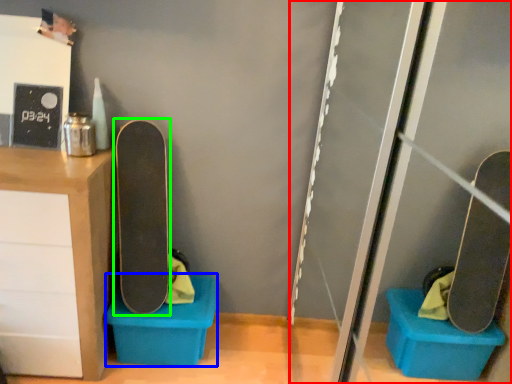
Question: Which is farther away from screen door (highlighted by a red box)? storage box (highlighted by a blue box) or skateboard (highlighted by a green box)?

Choices:
 (A) storage box
 (B) skateboard

Answer: (B)